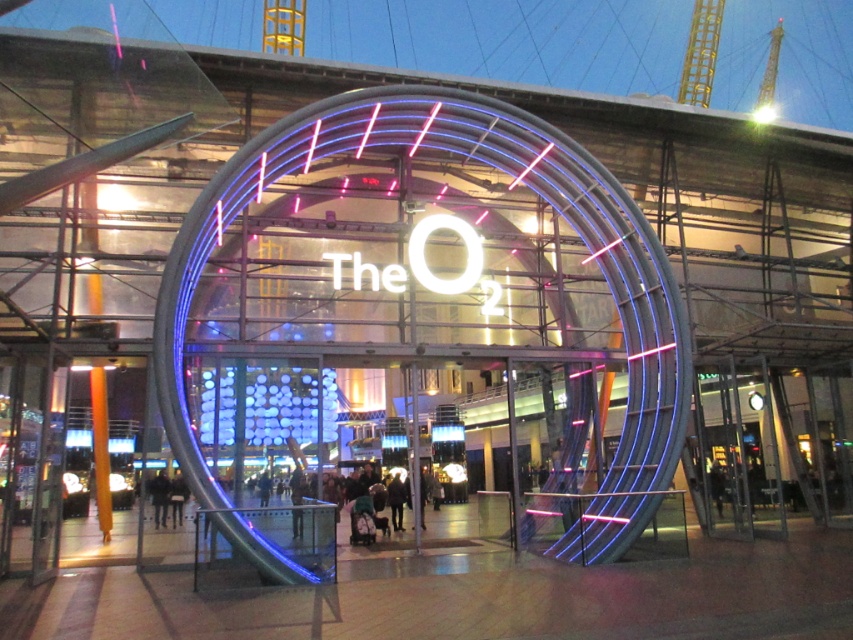
You are standing at the entrance of The O2 venue in London. You notice a point marked at coordinates (x=508, y=188). What object is located at this point?

The point at coordinates (x=508, y=188) corresponds to the neon blue glass at center.

You are planning to take a photo of the neon blue glass at center and dark brown leather coat at center at The O2 entrance. Which object should you focus on first if you want to capture both in a single frame without moving the camera?

You should focus on the neon blue glass at center first because its width is larger than the dark brown leather coat at center, so it will take up more space in the frame and ensure both are included without needing to adjust the camera position.